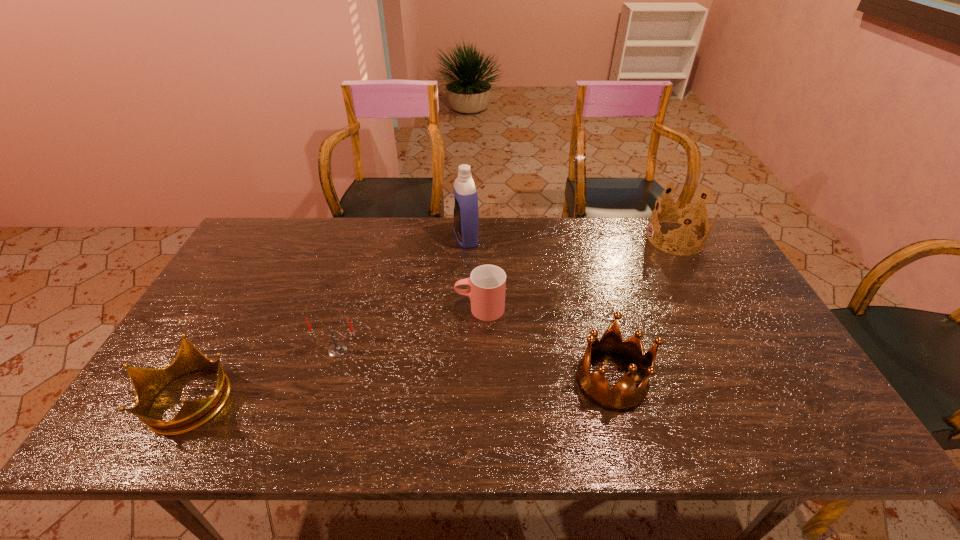
This screenshot has height=540, width=960. I want to click on free point between the shortest crown and the detergent, so click(327, 318).

Where is `unoccupied position between the candle and the detergent`? This screenshot has height=540, width=960. unoccupied position between the candle and the detergent is located at coordinates (402, 294).

Find the location of a particular element. vacant region between the detergent and the rightmost crown is located at coordinates (570, 238).

The image size is (960, 540). I want to click on object that is the third closest to the detergent, so click(x=624, y=396).

Identify which object is the third closest to the leftmost object. Please provide its 2D coordinates. Your answer should be formatted as a tuple, i.e. [(x, y)], where the tuple contains the x and y coordinates of a point satisfying the conditions above.

[(466, 217)]

Locate an element on the screen. The height and width of the screenshot is (540, 960). crown that stands as the second closest to the cup is located at coordinates (684, 213).

Locate an element on the screen. The image size is (960, 540). crown that stands as the third closest to the detergent is located at coordinates (147, 383).

Identify the location of blank area in the image that satisfies the following two spatial constraints: 1. on the front-facing side of the second crown from right to left; 2. on the right side of the candle. This screenshot has height=540, width=960. (328, 381).

The image size is (960, 540). I want to click on blank area in the image that satisfies the following two spatial constraints: 1. on the back side of the rightmost object; 2. on the right side of the fifth object from left to right, so click(574, 238).

The image size is (960, 540). Identify the location of vacant space that satisfies the following two spatial constraints: 1. on the side of the rightmost crown with the handle; 2. on the left side of the third farthest object. (480, 238).